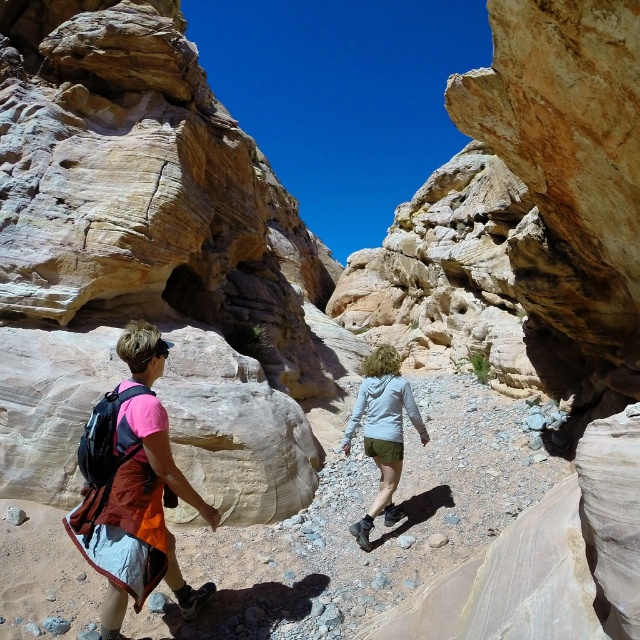
Question: Among these objects, which one is farthest from the camera?

Choices:
 (A) matte fabric backpack at left
 (B) white matte jacket at center

Answer: (B)

Question: Which of the following is the farthest from the observer?

Choices:
 (A) white matte jacket at center
 (B) matte fabric backpack at left
 (C) matte pink shirt at center

Answer: (A)

Question: Which object appears closest to the camera in this image?

Choices:
 (A) matte pink shirt at center
 (B) matte fabric backpack at left
 (C) white matte jacket at center

Answer: (A)

Question: Is matte fabric backpack at left wider than matte pink shirt at center?

Choices:
 (A) yes
 (B) no

Answer: (A)

Question: Is the position of matte fabric backpack at left less distant than that of matte pink shirt at center?

Choices:
 (A) yes
 (B) no

Answer: (B)

Question: Can you confirm if matte pink shirt at center is wider than white matte jacket at center?

Choices:
 (A) yes
 (B) no

Answer: (A)